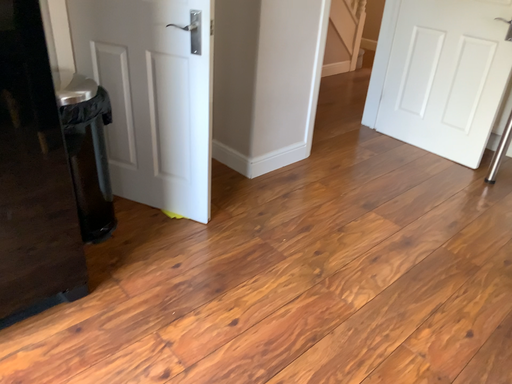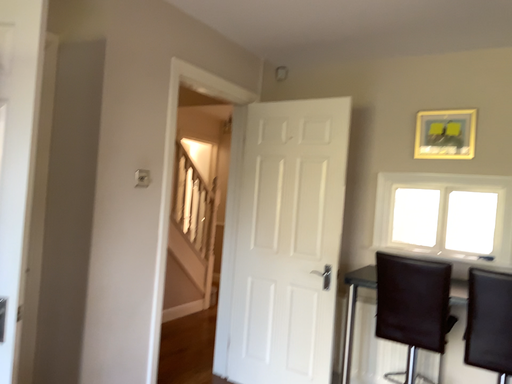
Question: Which way did the camera rotate in the video?

Choices:
 (A) rotated upward
 (B) rotated downward

Answer: (A)